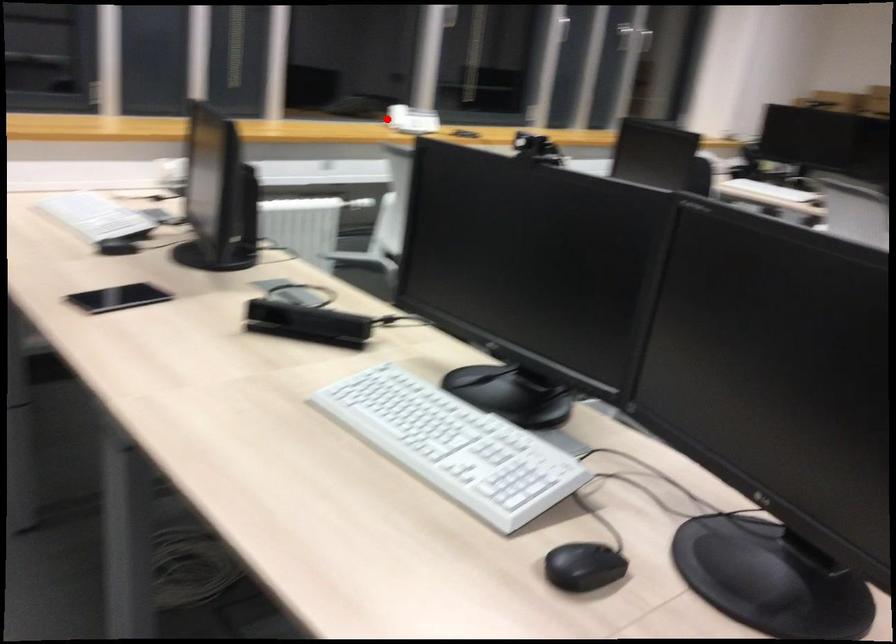
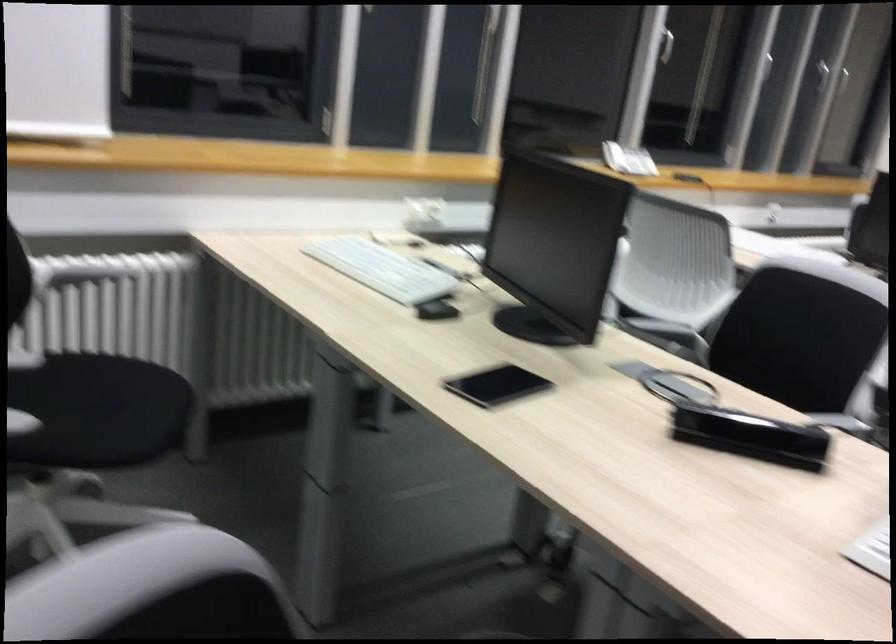
Where in the second image is the point corresponding to the highlighted location from the first image?

(614, 156)